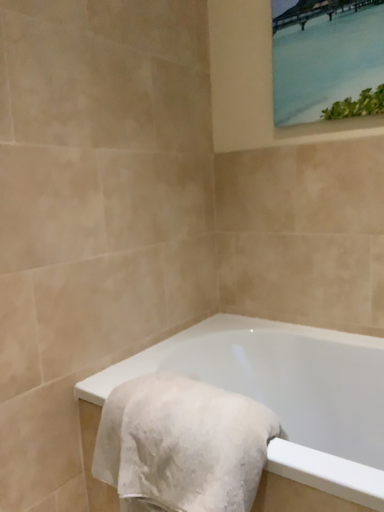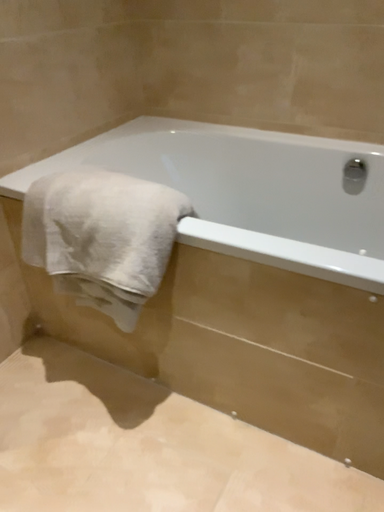
Question: Which way did the camera rotate in the video?

Choices:
 (A) rotated right
 (B) rotated left

Answer: (A)